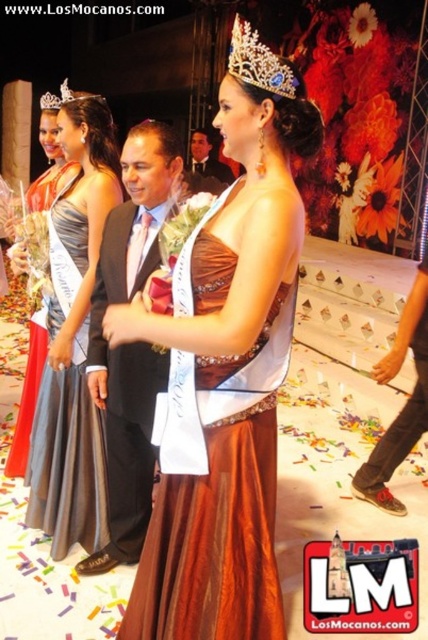
You are a photographer at the event and need to adjust your camera focus. The matte black suit at center and the silver metallic tiara at upper center are both in view. Which object should you focus on first if you want to capture the closer one?

The matte black suit at center is closer to you than the silver metallic tiara at upper center, so you should focus on the matte black suit at center first.

You are a photographer at the event and need to position two guests wearing the dark suit at center and the matte black suit at center for a group photo. Since you want them to stand side by side without overlapping, which guest should you place closer to the edge?

The dark suit at center has a smaller width than the matte black suit at center, so you should place the dark suit at center closer to the edge to ensure they can stand side by side without overlapping.

You are a photographer standing in front of the dark suit at center and want to take a closeup shot without moving the subject. If your camera requires a minimum distance of 1.5 meters to focus properly, will you be able to take the photo?

The dark suit at center is 1.79 meters away from the viewer. Since this distance is greater than the camera requirement of 1.5 meters, you can take the closeup shot without moving the subject.